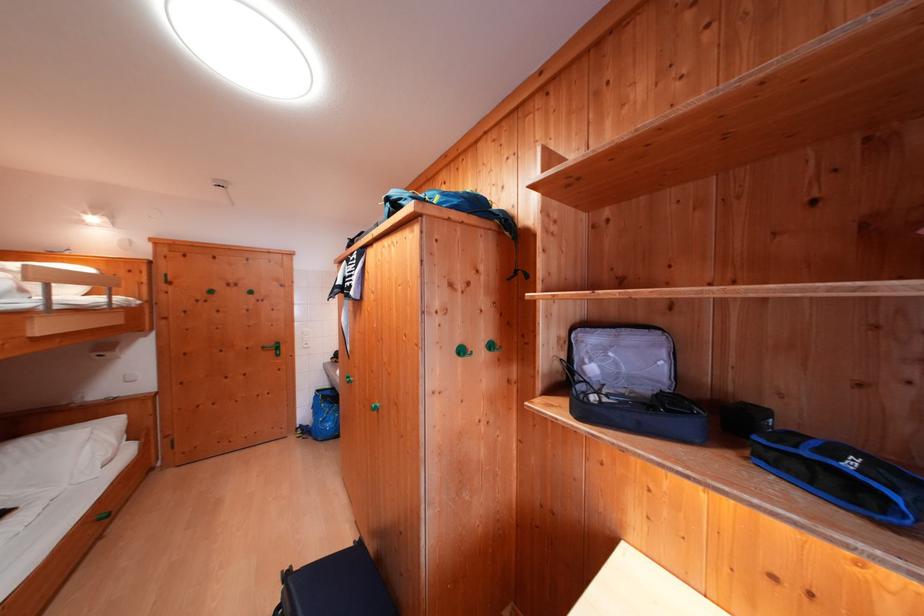
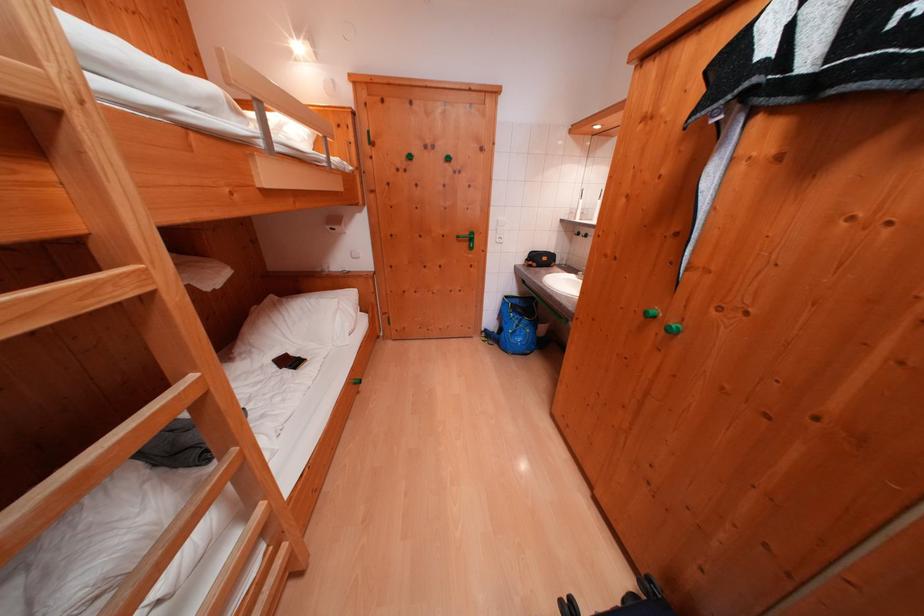
In the second image, find the point that corresponds to pixel 326 395 in the first image.

(515, 301)